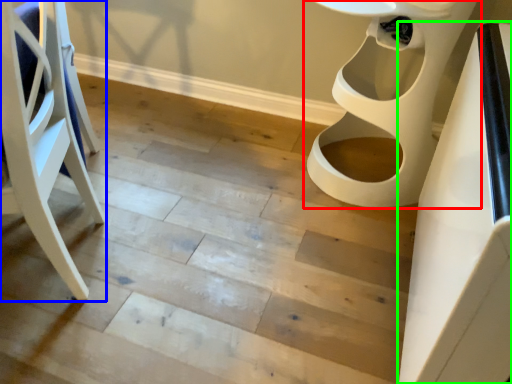
Question: Which object is positioned closest to toilet (highlighted by a red box)? Select from furniture (highlighted by a blue box) and table (highlighted by a green box).

Choices:
 (A) furniture
 (B) table

Answer: (B)